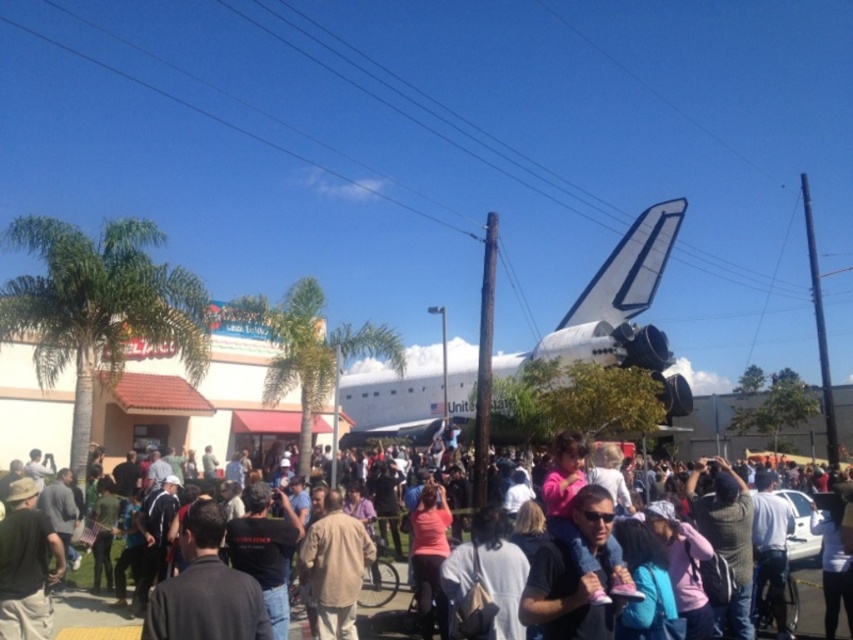
You are a photographer standing in the crowd and want to take a photo of the white matte space shuttle at center. However, there is a person wearing a beige fabric shirt at center blocking your view. Can you estimate if the space shuttle is wider than the shirt to determine if moving sideways might help you get a better shot?

The white matte space shuttle at center might be wider than beige fabric shirt at center, so moving sideways could help you get a better shot if the shuttle is wider, but you might need to adjust your position further.

You are a photographer trying to capture the white matte space shuttle at center without any obstructions from the matte black crowd at center. Based on the scene, can you confirm if the shuttle is tall enough to be seen above the crowd?

The white matte space shuttle at center has a greater height compared to the matte black crowd at center, so yes, it can be seen above the crowd without obstruction.